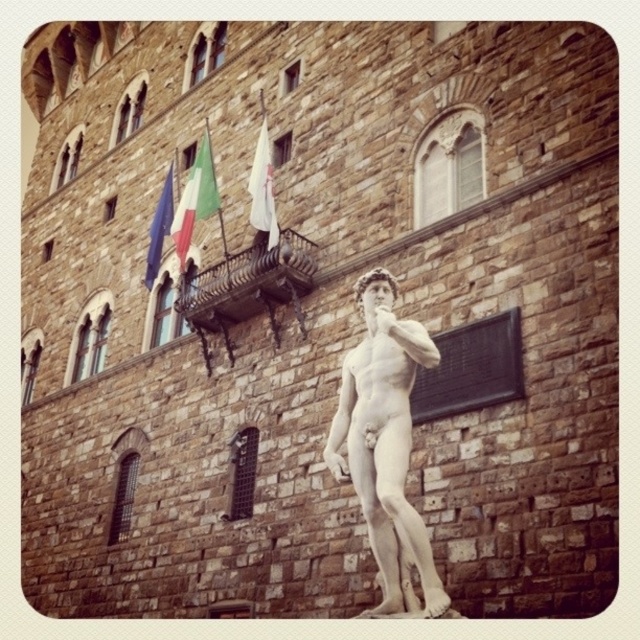
Question: Is white marble statue at center below white fabric flag at upper center?

Choices:
 (A) no
 (B) yes

Answer: (B)

Question: Considering the relative positions of white marble statue at center and white fabric flag at upper center in the image provided, where is white marble statue at center located with respect to white fabric flag at upper center?

Choices:
 (A) above
 (B) below

Answer: (B)

Question: Can you confirm if green fabric flag at upper center is smaller than white fabric flag at upper center?

Choices:
 (A) yes
 (B) no

Answer: (B)

Question: Which of the following is the closest to the observer?

Choices:
 (A) blue fabric flag at upper left
 (B) white fabric flag at upper center

Answer: (B)

Question: Which point is farther to the camera?

Choices:
 (A) (157, 240)
 (B) (209, 188)
 (C) (374, 518)
 (D) (275, 216)

Answer: (A)

Question: Among these points, which one is farthest from the camera?

Choices:
 (A) [372, 484]
 (B) [172, 200]
 (C) [198, 184]

Answer: (B)